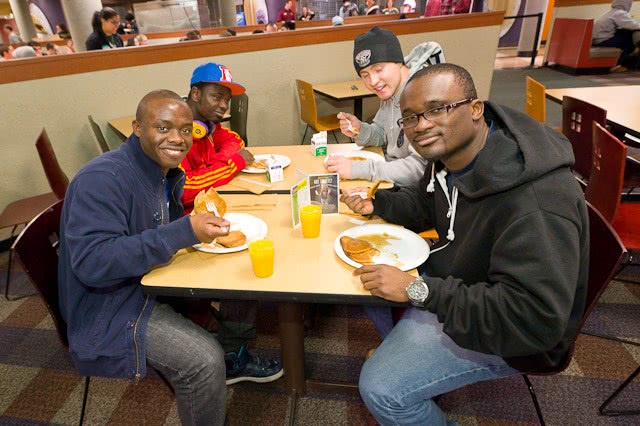
You are a GUI agent. You are given a task and a screenshot of the screen. Output one action in this format:
    pyautogui.click(x=<x>, y=<y>)
    Task: Click on the half wall
    This screenshot has height=426, width=640.
    Given the screenshot: What is the action you would take?
    pyautogui.click(x=76, y=110)